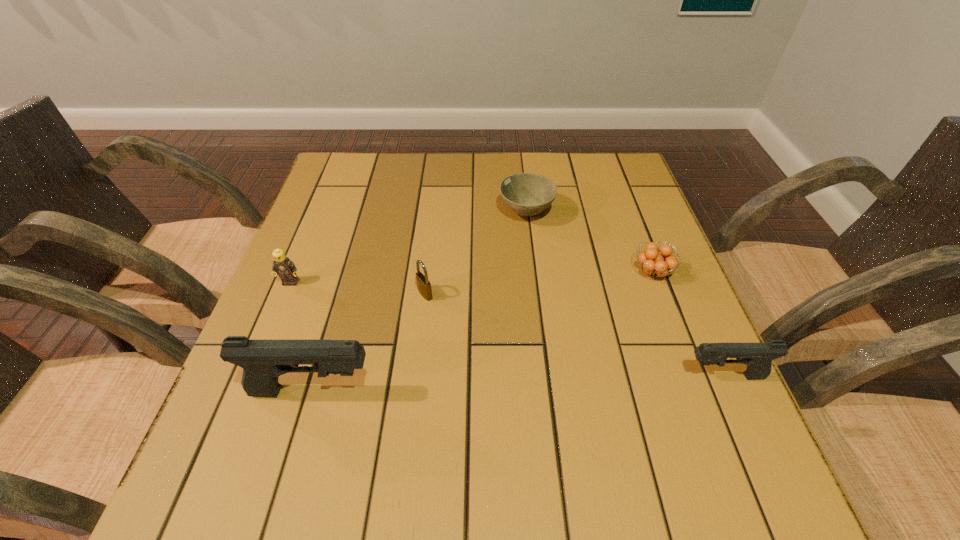
Locate an element on the screen. free space located at the barrel of the right pistol is located at coordinates [625, 376].

Identify the location of vacant region located at the barrel of the right pistol. The height and width of the screenshot is (540, 960). (613, 376).

Find the location of a particular element. The height and width of the screenshot is (540, 960). free space located at the barrel of the right pistol is located at coordinates (528, 376).

Where is `vacant area situated 0.060m on the left of the orange fruit`? Image resolution: width=960 pixels, height=540 pixels. vacant area situated 0.060m on the left of the orange fruit is located at coordinates (606, 272).

Locate an element on the screen. Image resolution: width=960 pixels, height=540 pixels. vacant region located in front of the Lego is located at coordinates (240, 407).

The width and height of the screenshot is (960, 540). I want to click on free spot located on the back of the padlock, so click(x=430, y=253).

Where is `vacant space located 0.190m on the left of the bowl`? The image size is (960, 540). vacant space located 0.190m on the left of the bowl is located at coordinates (426, 213).

At what (x,y) coordinates should I click in order to perform the action: click on object present at the far edge. Please return your answer as a coordinate pair (x, y). This screenshot has height=540, width=960. Looking at the image, I should click on (527, 194).

I want to click on object that is at the near edge, so click(263, 361).

The height and width of the screenshot is (540, 960). I want to click on pistol located in the left edge section of the desktop, so click(x=263, y=361).